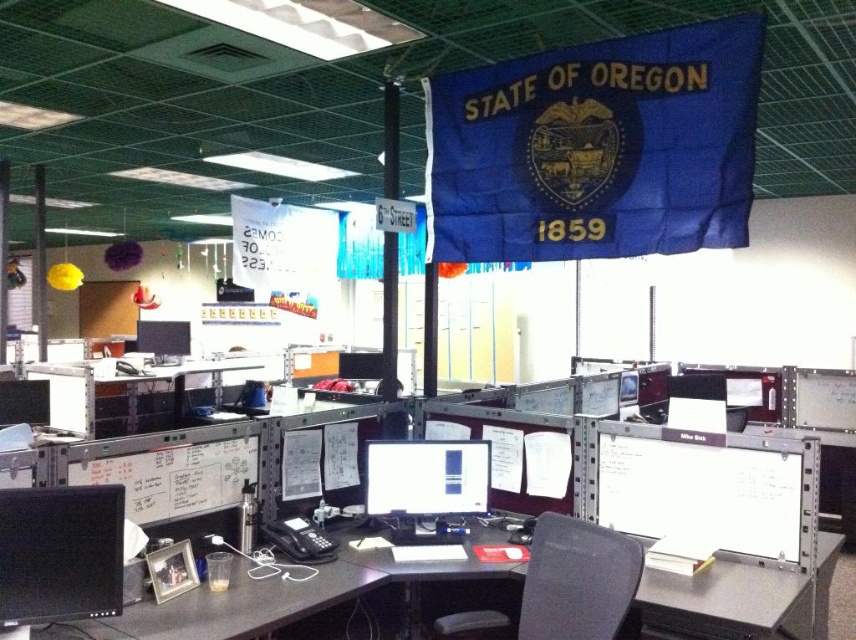
Does black plastic table at lower left appear over matte black monitor at center?

Actually, black plastic table at lower left is below matte black monitor at center.

What do you see at coordinates (270, 600) in the screenshot?
I see `black plastic table at lower left` at bounding box center [270, 600].

Locate an element on the screen. The image size is (856, 640). black plastic table at lower left is located at coordinates (270, 600).

Does blue fabric flag at upper center have a greater height compared to white paperboard at right?

Correct, blue fabric flag at upper center is much taller as white paperboard at right.

Which is more to the left, blue fabric flag at upper center or white paperboard at right?

blue fabric flag at upper center is more to the left.

Is point (526, 221) positioned before point (815, 449)?

No, it is behind (815, 449).

The width and height of the screenshot is (856, 640). Identify the location of blue fabric flag at upper center. (597, 148).

Can you confirm if black fabric swivel chair at center is positioned above matte black monitor at center?

No.

Between black fabric swivel chair at center and matte black monitor at center, which one has less height?

Standing shorter between the two is matte black monitor at center.

Does point (598, 632) come behind point (476, 454)?

No, it is not.

The width and height of the screenshot is (856, 640). Identify the location of black fabric swivel chair at center. (577, 579).